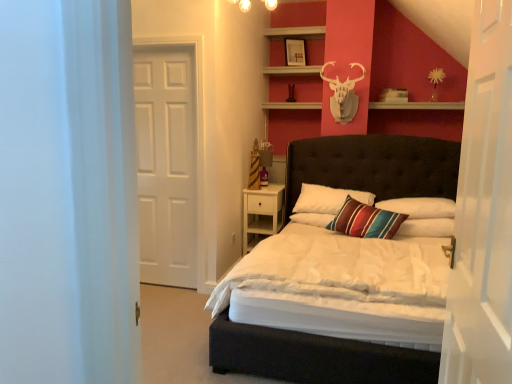
Where is `free point below matte white picture frame at upper center (from a real-world perspective)`? The image size is (512, 384). free point below matte white picture frame at upper center (from a real-world perspective) is located at coordinates (295, 59).